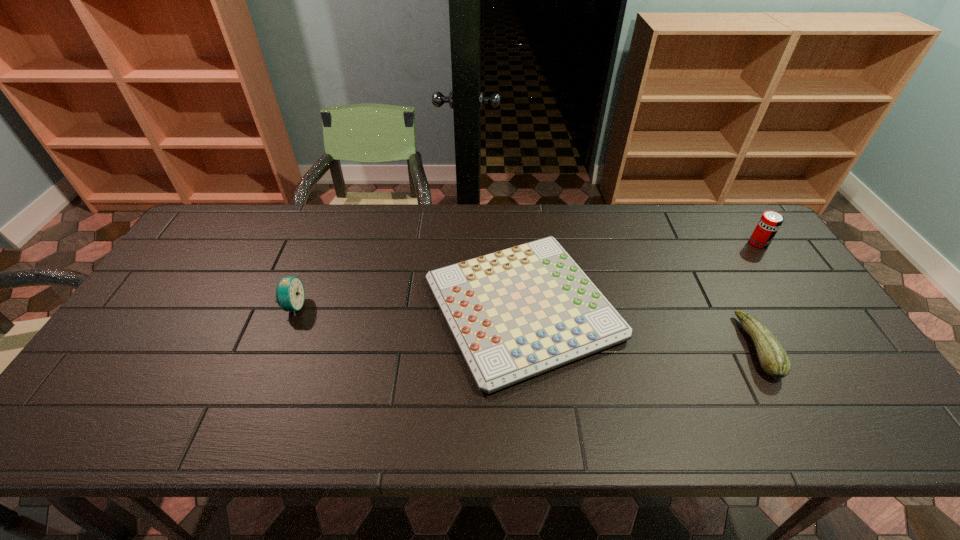
What are the coordinates of `object that is the closest to the shortest object` in the screenshot? It's located at click(x=773, y=358).

Identify which object is the third closest to the zucchini. Please provide its 2D coordinates. Your answer should be formatted as a tuple, i.e. [(x, y)], where the tuple contains the x and y coordinates of a point satisfying the conditions above.

[(290, 294)]

Locate an element on the screen. Image resolution: width=960 pixels, height=540 pixels. vacant space that satisfies the following two spatial constraints: 1. on the front-facing side of the leftmost object; 2. on the right side of the shortest object is located at coordinates (293, 308).

Locate an element on the screen. vacant area in the image that satisfies the following two spatial constraints: 1. on the front-facing side of the gameboard; 2. on the left side of the alarm clock is located at coordinates (293, 308).